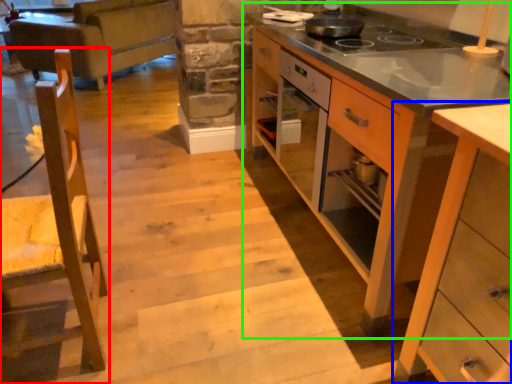
Question: Which object is positioned farthest from chair (highlighted by a red box)? Select from cabinetry (highlighted by a blue box) and cabinetry (highlighted by a green box).

Choices:
 (A) cabinetry
 (B) cabinetry

Answer: (B)